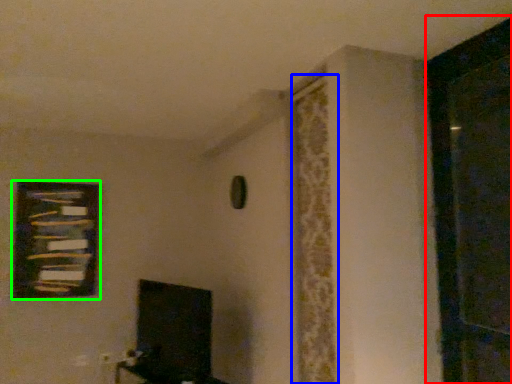
Question: Which object is the farthest from screen door (highlighted by a red box)? Choose among these: curtain (highlighted by a blue box) or picture frame (highlighted by a green box).

Choices:
 (A) curtain
 (B) picture frame

Answer: (B)